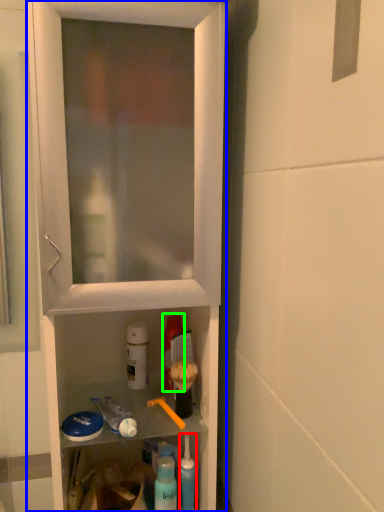
Question: Which is nearer to the toiletry (highlighted by a red box)? cabinetry (highlighted by a blue box) or mouthwash (highlighted by a green box).

Choices:
 (A) cabinetry
 (B) mouthwash

Answer: (B)